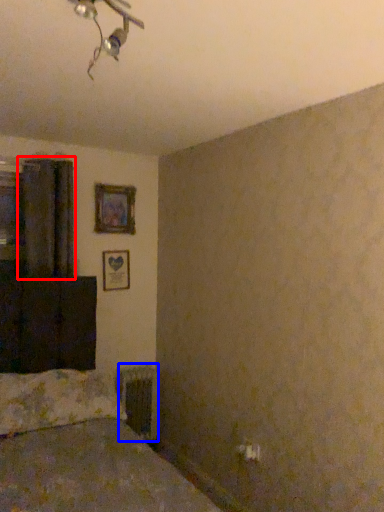
Question: Which point is further to the camera, curtain (highlighted by a red box) or radiator (highlighted by a blue box)?

Choices:
 (A) curtain
 (B) radiator

Answer: (B)